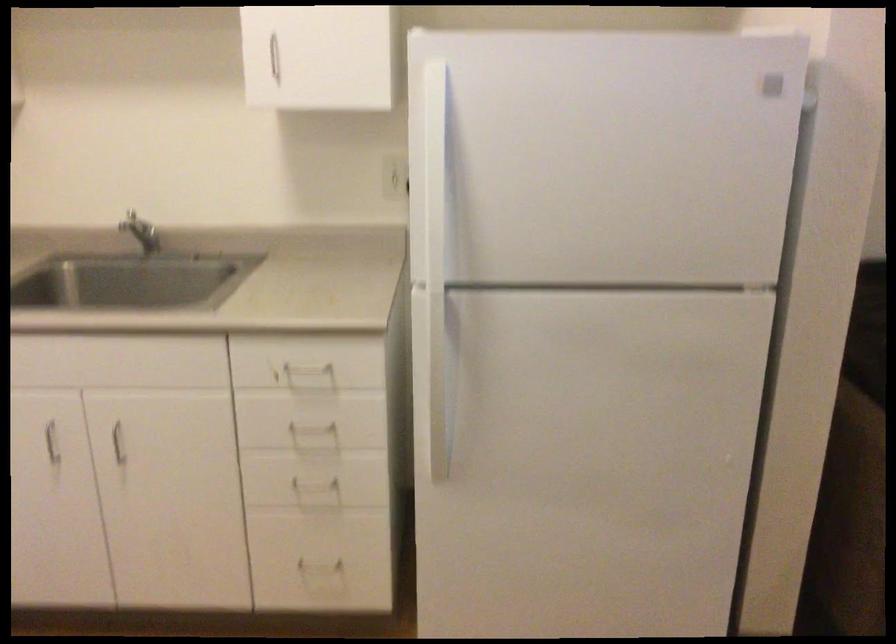
You are a GUI agent. You are given a task and a screenshot of the screen. Output one action in this format:
    pyautogui.click(x=<x>, y=<y>)
    Task: Click on the upper cabinet handle
    Image resolution: width=896 pixels, height=644 pixels.
    Given the screenshot: What is the action you would take?
    pyautogui.click(x=270, y=59)